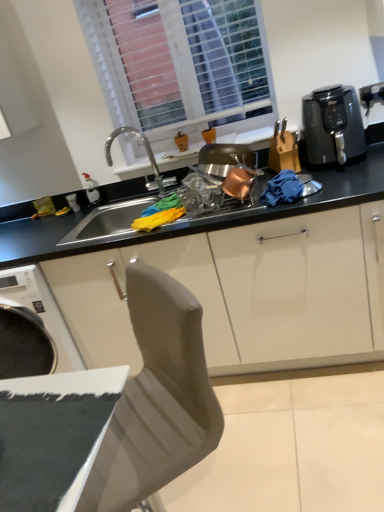
Locate an element on the screen. vacant space situated above black matte countertop at center (from a real-world perspective) is located at coordinates (102, 181).